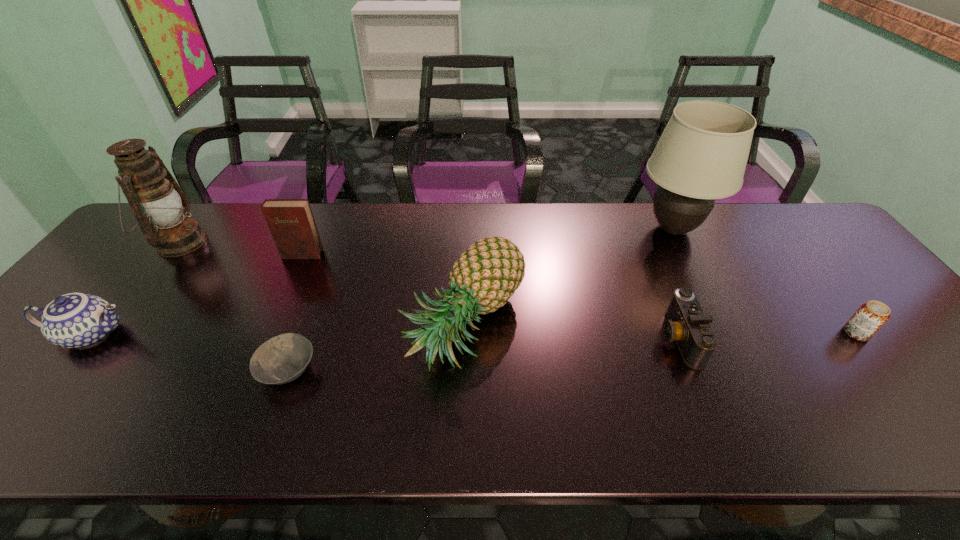
At what (x,y) coordinates should I click in order to perform the action: click on lampshade. Please return your answer as a coordinate pair (x, y). This screenshot has width=960, height=540. Looking at the image, I should click on (702, 154).

This screenshot has width=960, height=540. I want to click on lantern, so click(x=154, y=196).

At what (x,y) coordinates should I click in order to perform the action: click on pineapple. Please return your answer as a coordinate pair (x, y). Image resolution: width=960 pixels, height=540 pixels. Looking at the image, I should click on (486, 275).

At what (x,y) coordinates should I click in order to perform the action: click on diary. Please return your answer as a coordinate pair (x, y). The image size is (960, 540). Looking at the image, I should click on (291, 222).

Identify the location of chinaware. The width and height of the screenshot is (960, 540). (75, 320).

The height and width of the screenshot is (540, 960). Find the location of `the rightmost object`. the rightmost object is located at coordinates (871, 316).

Locate an element on the screen. The width and height of the screenshot is (960, 540). camera is located at coordinates (686, 323).

At what (x,y) coordinates should I click in order to perform the action: click on bowl. Please return your answer as a coordinate pair (x, y). Looking at the image, I should click on (283, 358).

Where is `free location located on the front of the lampshade`? This screenshot has height=540, width=960. free location located on the front of the lampshade is located at coordinates (733, 349).

The width and height of the screenshot is (960, 540). Find the location of `free region located 0.190m on the front of the lantern`. free region located 0.190m on the front of the lantern is located at coordinates (122, 317).